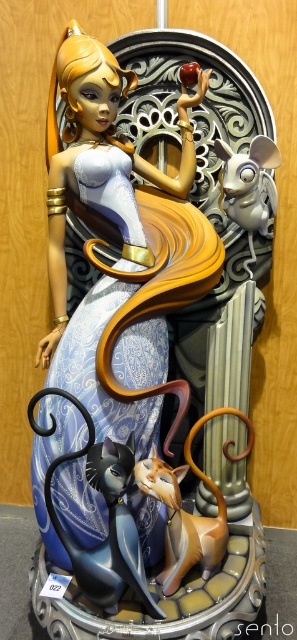
Does matte black cat at lower center have a larger size compared to satin silver mouse at upper right?

Incorrect, matte black cat at lower center is not larger than satin silver mouse at upper right.

Can you confirm if matte black cat at lower center is thinner than satin silver mouse at upper right?

No, matte black cat at lower center is not thinner than satin silver mouse at upper right.

Is point (48, 500) positioned before point (225, 147)?

Yes.

Where is `matte black cat at lower center`? The image size is (297, 640). matte black cat at lower center is located at coordinates (108, 529).

Which is above, matte blue fabric doll at center or matte black cat at lower center?

matte blue fabric doll at center is higher up.

Does matte blue fabric doll at center have a greater width compared to matte black cat at lower center?

Yes, matte blue fabric doll at center is wider than matte black cat at lower center.

Is point (70, 468) in front of point (71, 550)?

Yes, point (70, 468) is closer to viewer.

Locate an element on the screen. The width and height of the screenshot is (297, 640). matte blue fabric doll at center is located at coordinates [x=100, y=220].

Between matte black cat at lower center and shiny gold cat at center, which one has less height?

shiny gold cat at center is shorter.

Does matte black cat at lower center appear on the right side of shiny gold cat at center?

Incorrect, matte black cat at lower center is not on the right side of shiny gold cat at center.

Does point (120, 534) come closer to viewer compared to point (179, 508)?

Yes, point (120, 534) is in front of point (179, 508).

Identify the location of matte black cat at lower center. (108, 529).